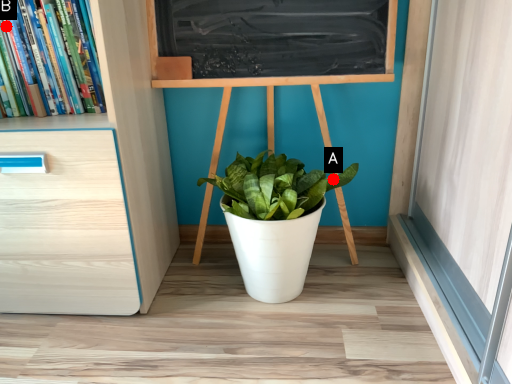
Question: Two points are circled on the image, labeled by A and B beside each circle. Which point appears farthest from the camera in this image?

Choices:
 (A) A is further
 (B) B is further

Answer: (A)